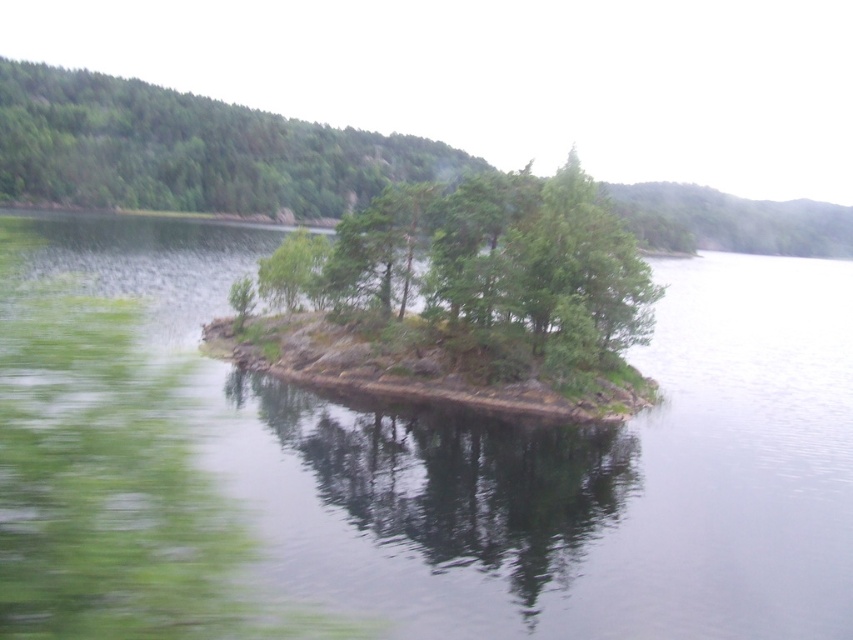
Based on the photo, is green leafy trees at center to the right of green matte tree at upper left from the viewer's perspective?

Correct, you'll find green leafy trees at center to the right of green matte tree at upper left.

What do you see at coordinates (498, 273) in the screenshot?
I see `green leafy trees at center` at bounding box center [498, 273].

The height and width of the screenshot is (640, 853). I want to click on green leafy trees at center, so click(x=498, y=273).

Can you confirm if greenish water at center is taller than green matte tree at upper left?

No.

Does greenish water at center have a lesser width compared to green matte tree at upper left?

Yes.

Is point (514, 513) farther from viewer compared to point (76, 97)?

No.

Where is `greenish water at center`? greenish water at center is located at coordinates (579, 481).

Can you confirm if greenish water at center is positioned to the left of green leafy tree at center?

Indeed, greenish water at center is positioned on the left side of green leafy tree at center.

Between greenish water at center and green leafy tree at center, which one appears on the right side from the viewer's perspective?

green leafy tree at center is more to the right.

Is point (157, 301) less distant than point (267, 294)?

No, it is behind (267, 294).

Where is `greenish water at center`? The height and width of the screenshot is (640, 853). greenish water at center is located at coordinates (579, 481).